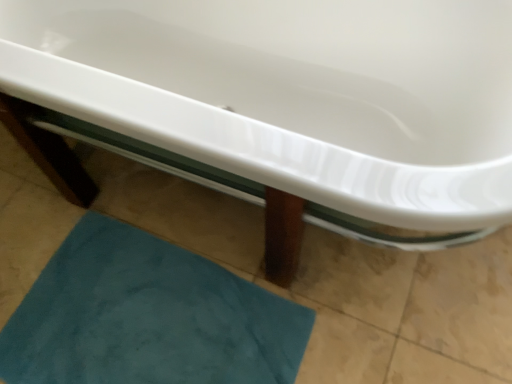
Question: Considering the relative sizes of teal plush bath mat at lower left and white glossy bathtub at center in the image provided, is teal plush bath mat at lower left smaller than white glossy bathtub at center?

Choices:
 (A) no
 (B) yes

Answer: (B)

Question: From a real-world perspective, is teal plush bath mat at lower left below white glossy bathtub at center?

Choices:
 (A) no
 (B) yes

Answer: (B)

Question: Considering the relative sizes of teal plush bath mat at lower left and white glossy bathtub at center in the image provided, is teal plush bath mat at lower left wider than white glossy bathtub at center?

Choices:
 (A) yes
 (B) no

Answer: (B)

Question: Does teal plush bath mat at lower left have a greater height compared to white glossy bathtub at center?

Choices:
 (A) yes
 (B) no

Answer: (B)

Question: Does teal plush bath mat at lower left come behind white glossy bathtub at center?

Choices:
 (A) yes
 (B) no

Answer: (A)

Question: From a real-world perspective, is teal plush bath mat at lower left positioned over white glossy bathtub at center based on gravity?

Choices:
 (A) yes
 (B) no

Answer: (B)

Question: Would you say white glossy bathtub at center is a long distance from teal plush bath mat at lower left?

Choices:
 (A) yes
 (B) no

Answer: (B)

Question: Is the depth of white glossy bathtub at center greater than that of teal plush bath mat at lower left?

Choices:
 (A) no
 (B) yes

Answer: (A)

Question: Can you confirm if white glossy bathtub at center is thinner than teal plush bath mat at lower left?

Choices:
 (A) no
 (B) yes

Answer: (A)

Question: Does white glossy bathtub at center have a smaller size compared to teal plush bath mat at lower left?

Choices:
 (A) yes
 (B) no

Answer: (B)

Question: Is white glossy bathtub at center in front of teal plush bath mat at lower left?

Choices:
 (A) no
 (B) yes

Answer: (B)

Question: From a real-world perspective, is white glossy bathtub at center physically below teal plush bath mat at lower left?

Choices:
 (A) yes
 (B) no

Answer: (B)

Question: Is point (75, 337) positioned closer to the camera than point (141, 3)?

Choices:
 (A) closer
 (B) farther

Answer: (A)